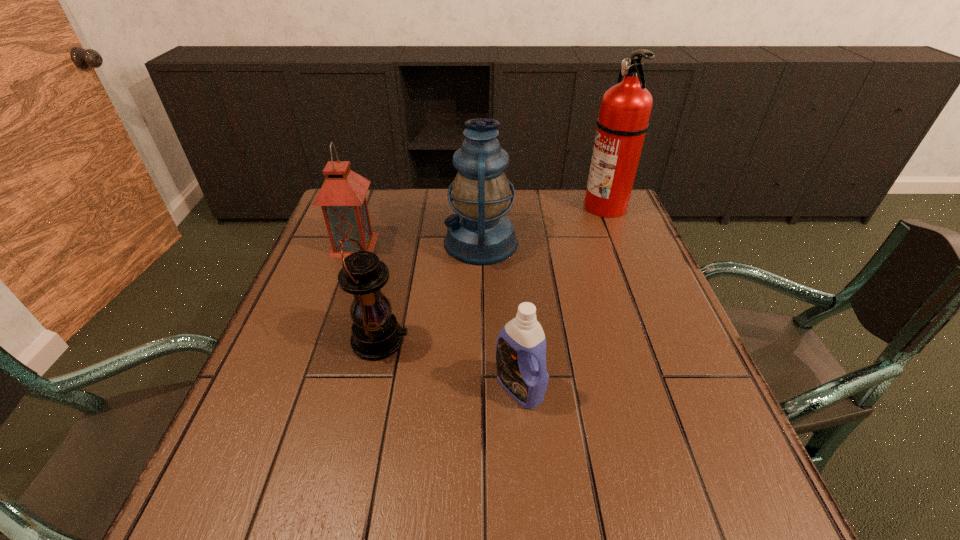
What are the coordinates of `object positioned at the far left corner` in the screenshot? It's located at (342, 197).

In order to click on object present at the far right corner in this screenshot , I will do `click(625, 110)`.

In the image, there is a desktop. At what (x,y) coordinates should I click in order to perform the action: click on vacant space at the far edge. Please return your answer as a coordinate pair (x, y). This screenshot has height=540, width=960. Looking at the image, I should click on (389, 207).

The height and width of the screenshot is (540, 960). In the image, there is a desktop. Identify the location of vacant space at the near edge. (329, 485).

Identify the location of free region at the left edge of the desktop. The width and height of the screenshot is (960, 540). (294, 464).

Locate an element on the screen. Image resolution: width=960 pixels, height=540 pixels. vacant area at the right edge of the desktop is located at coordinates (625, 283).

Where is `vacant space at the near right corner of the desktop`? The image size is (960, 540). vacant space at the near right corner of the desktop is located at coordinates (662, 497).

Locate an element on the screen. This screenshot has width=960, height=540. free spot between the rightmost lantern and the leftmost lantern is located at coordinates (418, 243).

The width and height of the screenshot is (960, 540). Find the location of `vacant space in between the nearest lantern and the detergent`. vacant space in between the nearest lantern and the detergent is located at coordinates (450, 364).

Locate an element on the screen. This screenshot has width=960, height=540. empty space between the shortest object and the fourth object from right to left is located at coordinates (450, 364).